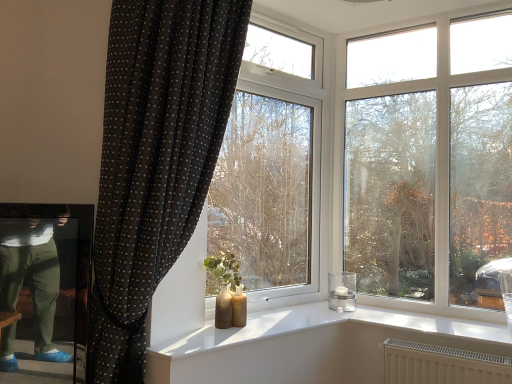
Question: In the image, is transparent glass window at center positioned in front of or behind black dotted fabric curtain at left?

Choices:
 (A) behind
 (B) front

Answer: (A)

Question: Is transparent glass window at center bigger or smaller than black dotted fabric curtain at left?

Choices:
 (A) small
 (B) big

Answer: (A)

Question: Estimate the real-world distances between objects in this image. Which object is farther from the transparent glass tree at center?

Choices:
 (A) clear glass candle holder at window
 (B) black dotted fabric curtain at left
 (C) transparent glass window at center

Answer: (B)

Question: Which is farther from the transparent glass tree at center?

Choices:
 (A) black dotted fabric curtain at left
 (B) clear glass candle holder at window
 (C) transparent glass window at center

Answer: (A)